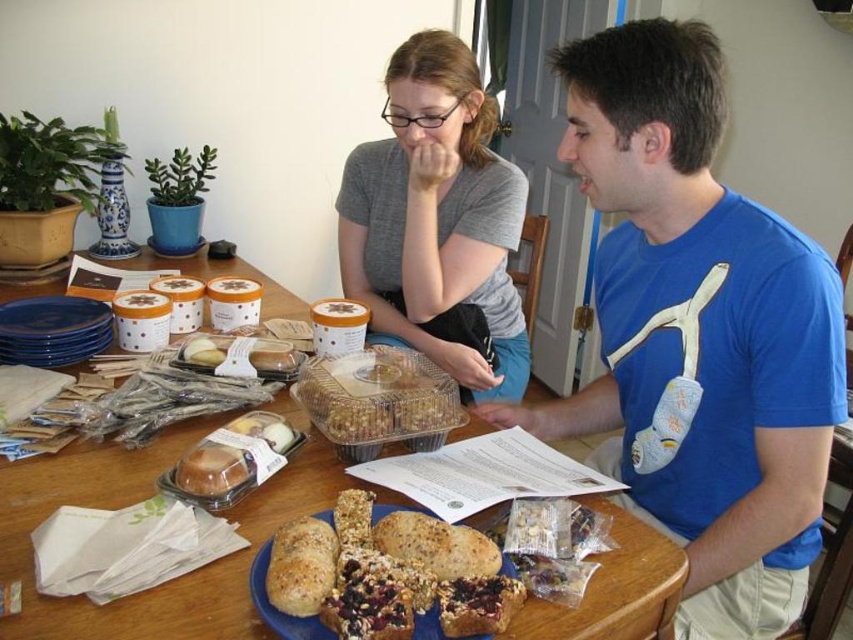
You are a photographer trying to capture a candid shot of the gray matte shirt at upper center and the brown textured bread at center. You need to ensure both are in focus. Given that your camera has a depth of field that can cover 30 inches, will you be able to achieve this?

The gray matte shirt at upper center and brown textured bread at center are 31.13 inches apart. Since the camera can only cover 30 inches, the depth of field is insufficient to keep both in focus simultaneously.